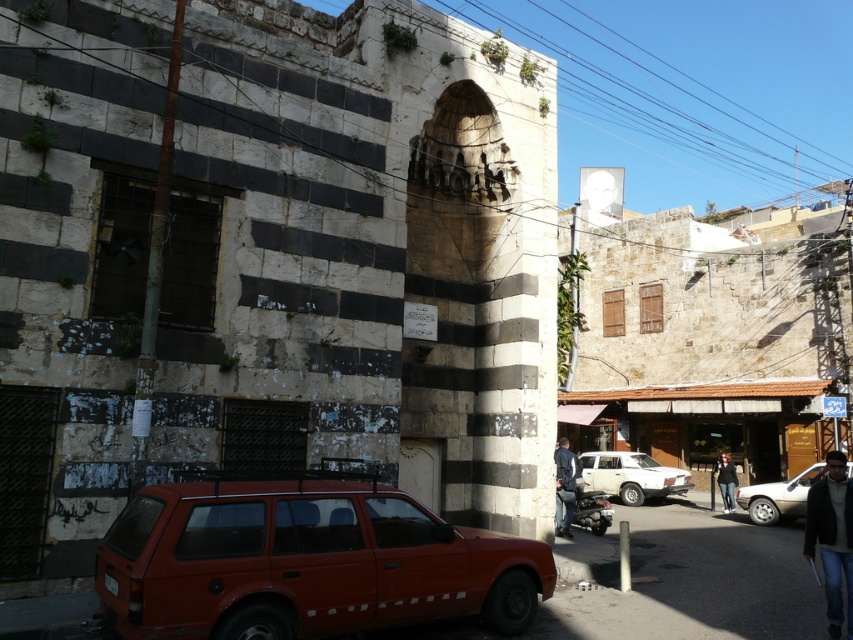
Question: Is the position of rusty matte suv at lower left less distant than that of smooth asphalt alley at lower right?

Choices:
 (A) yes
 (B) no

Answer: (A)

Question: Based on their relative distances, which object is nearer to the white matte car at center?

Choices:
 (A) silver metallic sedan at lower right
 (B) rusty matte suv at lower left
 (C) dark blue jeans at center
 (D) smooth asphalt alley at lower right

Answer: (A)

Question: Can you confirm if rusty matte suv at lower left is thinner than white matte car at center?

Choices:
 (A) no
 (B) yes

Answer: (A)

Question: Which point is closer to the camera taking this photo?

Choices:
 (A) (282, 540)
 (B) (787, 497)

Answer: (A)

Question: Which point is closer to the camera?

Choices:
 (A) (766, 506)
 (B) (838, 605)
 (C) (672, 492)

Answer: (B)

Question: Can you confirm if smooth asphalt alley at lower right is thinner than silver metallic sedan at lower right?

Choices:
 (A) yes
 (B) no

Answer: (B)